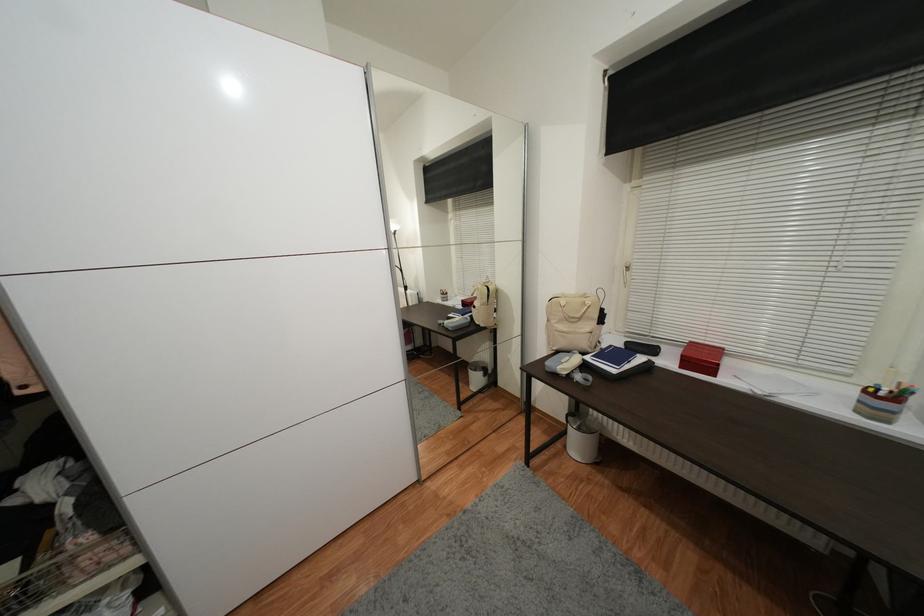
The height and width of the screenshot is (616, 924). What do you see at coordinates (871, 167) in the screenshot?
I see `a blinds pull chain` at bounding box center [871, 167].